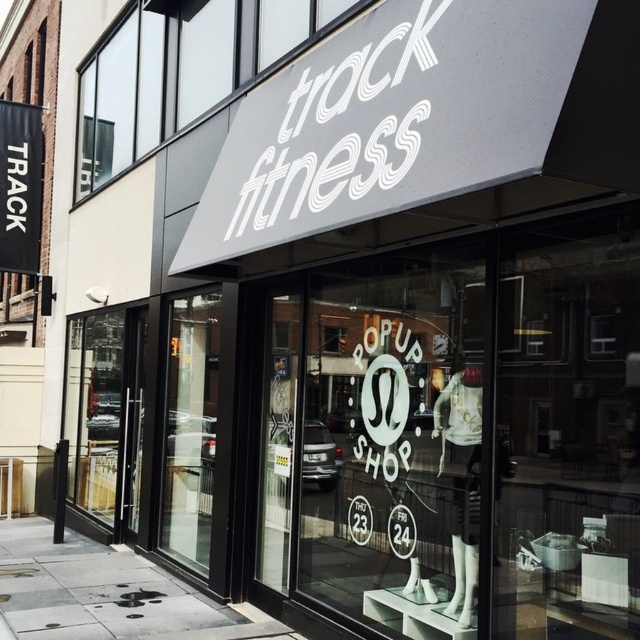
You are a delivery person trying to deliver a package to the entrance of Track Fitness. You see the gray concrete sidewalk at lower center and the transparent glass door at center. Which path is wider for your delivery cart?

The gray concrete sidewalk at lower center is wider than the transparent glass door at center, so the delivery cart can fit through the gray concrete sidewalk at lower center.

Please provide the 2D coordinates of the white matte signboard at upper center in the image. The answer should be in the format of a point with two decimal places separated by a comma, like 0.12,0.34.

The 2D coordinates of the white matte signboard at upper center are at point (180,72).